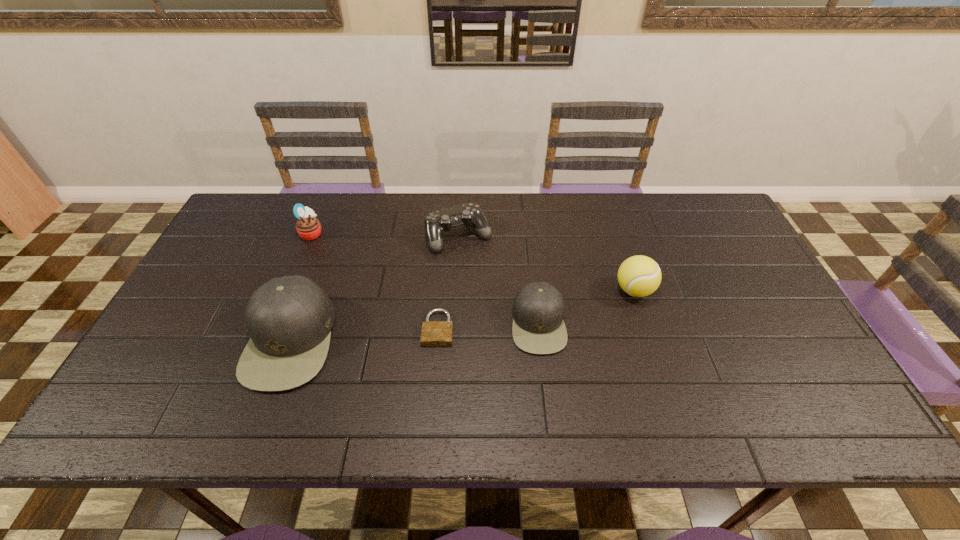
This screenshot has width=960, height=540. Find the location of `vacant space that satisfies the following two spatial constraints: 1. on the brim of the right cap; 2. on the keyhole side of the padlock`. vacant space that satisfies the following two spatial constraints: 1. on the brim of the right cap; 2. on the keyhole side of the padlock is located at coordinates (539, 328).

You are a GUI agent. You are given a task and a screenshot of the screen. Output one action in this format:
    pyautogui.click(x=<x>, y=<y>)
    Task: Click on the free point that satisfies the following two spatial constraints: 1. on the front-facing side of the muffin; 2. on the left side of the control
    
    Given the screenshot: What is the action you would take?
    pyautogui.click(x=310, y=236)

Image resolution: width=960 pixels, height=540 pixels. What are the coordinates of `free space in the image that satisfies the following two spatial constraints: 1. on the front side of the rightmost object; 2. on the brim of the shorter cap` in the screenshot? It's located at (645, 323).

At what (x,y) coordinates should I click in order to perform the action: click on free space that satisfies the following two spatial constraints: 1. on the brim of the right cap; 2. on the keyhole side of the shortest object. Please return your answer as a coordinate pair (x, y). The width and height of the screenshot is (960, 540). Looking at the image, I should click on (539, 328).